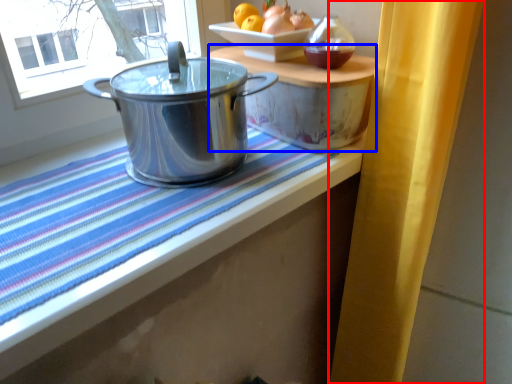
Question: Which object is further to the camera taking this photo, curtain (highlighted by a red box) or table (highlighted by a blue box)?

Choices:
 (A) curtain
 (B) table

Answer: (B)